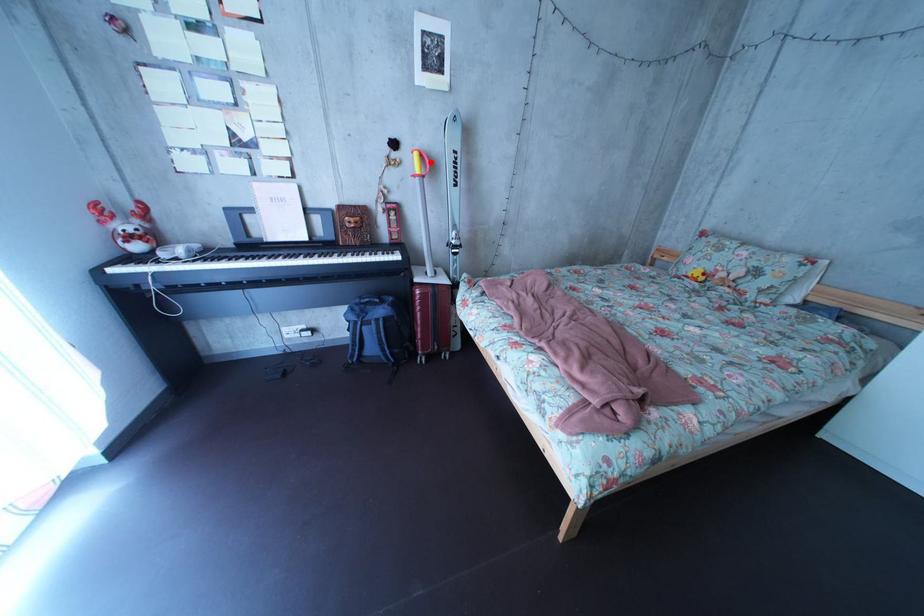
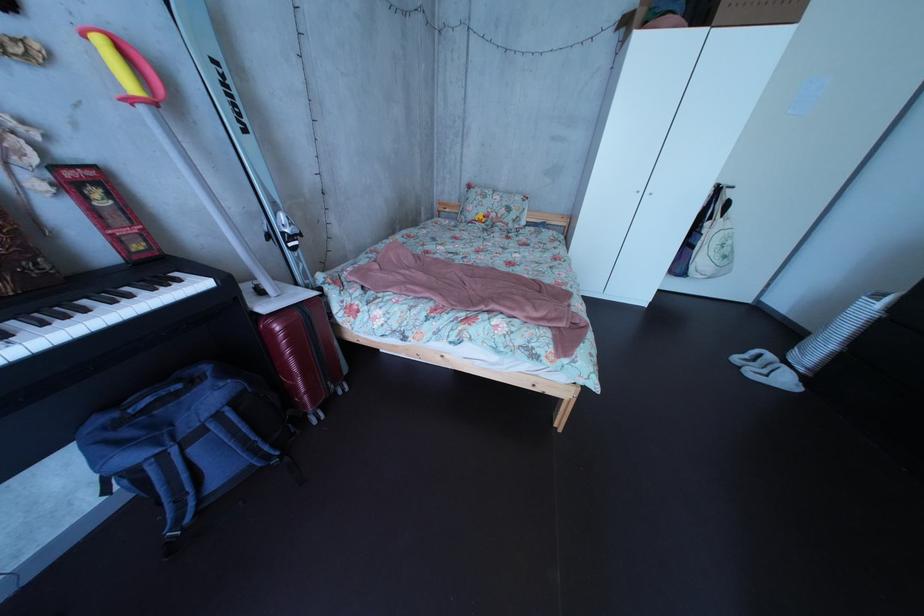
Find the pixel in the second image that matches the highlighted location in the first image.

(116, 51)